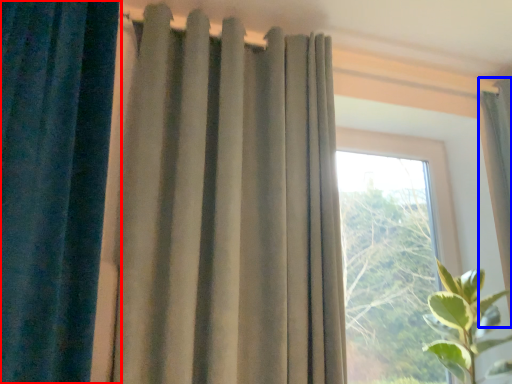
Question: Which of the following is the farthest to the observer, curtain (highlighted by a red box) or curtain (highlighted by a blue box)?

Choices:
 (A) curtain
 (B) curtain

Answer: (B)